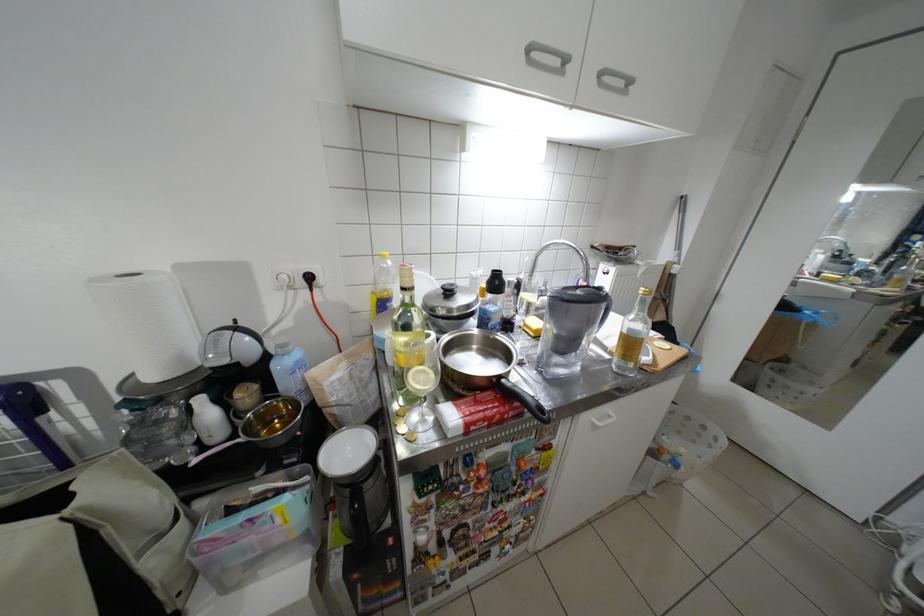
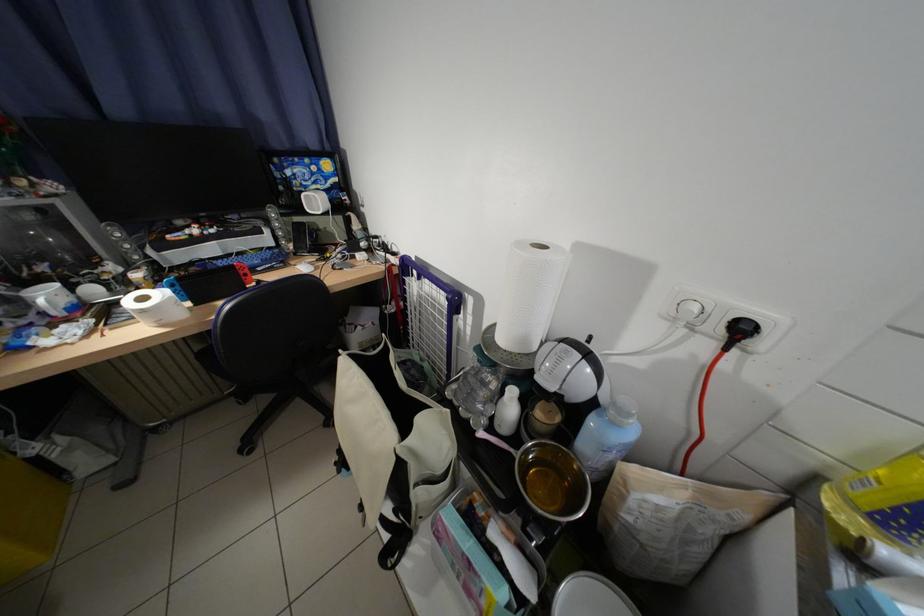
In the second image, find the point that corresponds to (90,503) in the first image.

(419, 442)